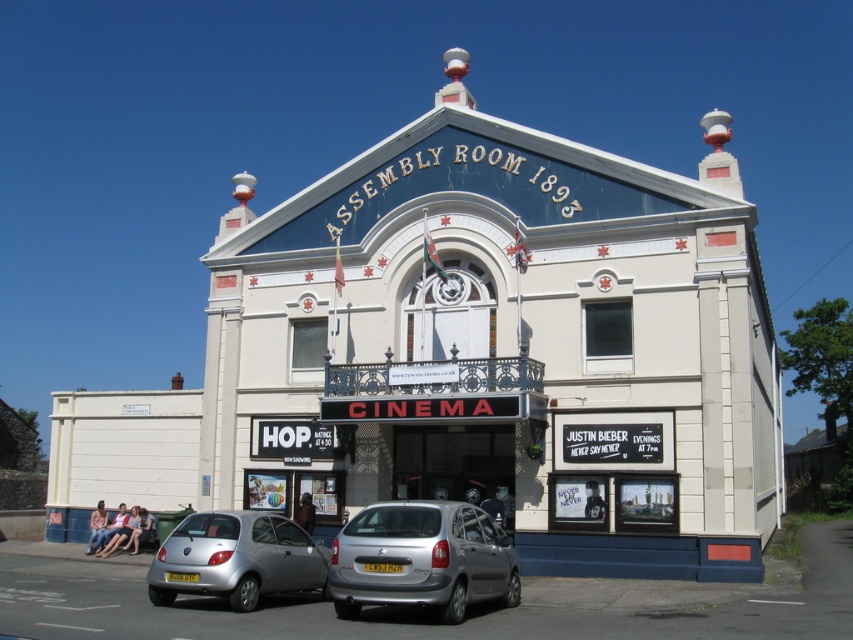
You are standing in front of the cinema building labeled ASSEMBLY ROOM 1893. You see two points marked on the building. The first point is at coordinate point (517, 602) and the second is at point (258, 545). If you were to walk towards the building, which point would appear closer to you?

Point (258, 545) is closer to you because it is less further away than point (517, 602), which is further away from the camera. Since you are walking towards the building, the point closer to the camera in the image would be the one that is physically closer to you as you approach.

You are parking your car in the parking lot near the cinema building labeled ASSEMBLY ROOM 1893. You see a silver metallic hatchback at lower center and a silver metallic car at lower left. Which one is bigger?

The silver metallic hatchback at lower center is larger in size than the silver metallic car at lower left.

You are a visitor arriving at the cinema and need to park your car. You see a silver metallic hatchback at lower center and a silver metallic car at lower left. Which parking spot is closer to the cinema entrance?

The silver metallic hatchback at lower center is closer to the cinema entrance because it is nearer to the viewer compared to the silver metallic car at lower left.